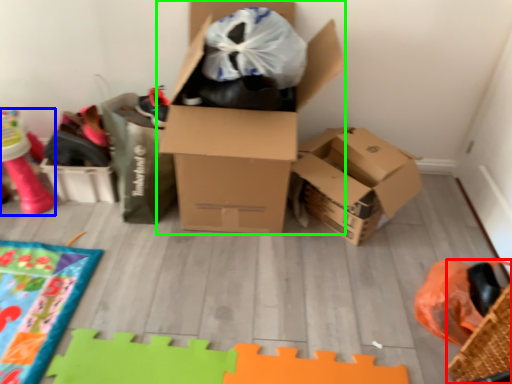
Question: Considering the real-world distances, which object is farthest from basket (highlighted by a red box)? toy (highlighted by a blue box) or box (highlighted by a green box)?

Choices:
 (A) toy
 (B) box

Answer: (A)